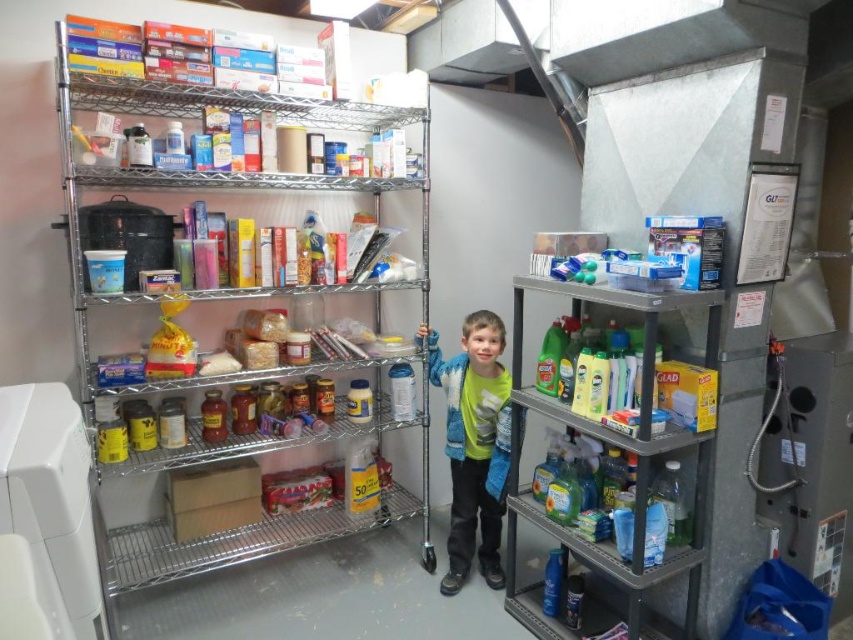
Can you confirm if blue fleece jacket at center is thinner than metallic silver shelves at upper left?

Yes.

Can you confirm if blue fleece jacket at center is wider than metallic silver shelves at upper left?

No, blue fleece jacket at center is not wider than metallic silver shelves at upper left.

Is point (503, 442) positioned behind point (376, 289)?

No, (503, 442) is in front of (376, 289).

Where is `blue fleece jacket at center`? blue fleece jacket at center is located at coordinates (474, 444).

Is point (426, 392) positioned in front of point (489, 483)?

No, it is behind (489, 483).

Is metallic silver shelves at left bigger than blue fleece jacket at center?

Yes.

Between point (195, 260) and point (459, 460), which one is positioned behind?

The point (459, 460) is more distant.

At what (x,y) coordinates should I click in order to perform the action: click on metallic silver shelves at left. Please return your answer as a coordinate pair (x, y). The image size is (853, 640). Looking at the image, I should click on (228, 336).

Does gray plastic shelf at right lie behind blue fleece jacket at center?

No, gray plastic shelf at right is closer to the viewer.

Identify the location of gray plastic shelf at right. (618, 448).